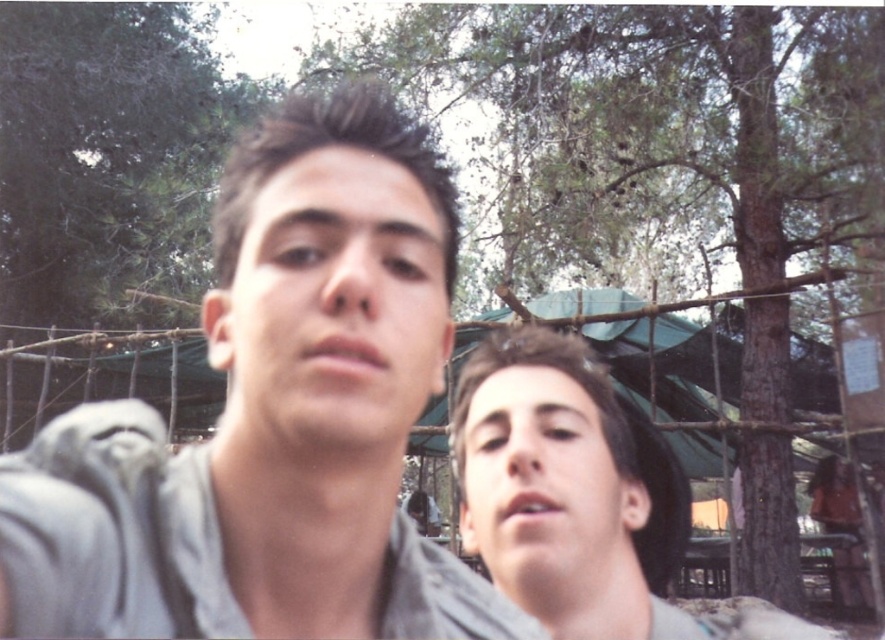
In the scene shown: You are a photographer trying to capture a wide shot of the scene. Given that the green leafy tree at upper center is wider than the smooth skin face at lower right, which object would require more space in the frame to ensure it is fully visible?

The green leafy tree at upper center requires more space in the frame because its width surpasses that of the smooth skin face at lower right.

You are a photographer trying to capture a photo of the gray matte shirt at center and the green leafy tree at upper center. Which object is closer to the camera?

The gray matte shirt at center is closer to the camera because it is shorter than the green leafy tree at upper center.